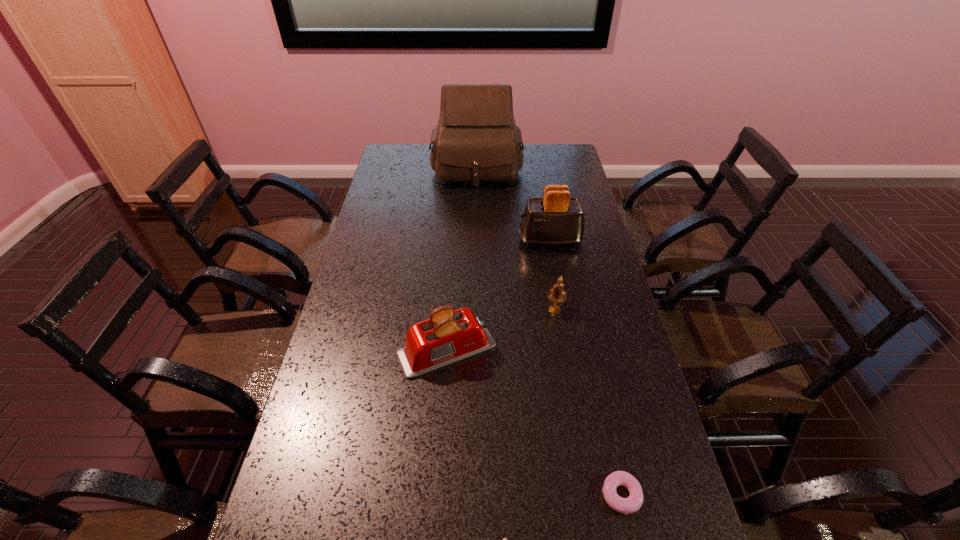
You are a GUI agent. You are given a task and a screenshot of the screen. Output one action in this format:
    pyautogui.click(x=<x>, y=<y>)
    Task: Click on the empty location between the candle holder and the satchel
    
    Given the screenshot: What is the action you would take?
    pyautogui.click(x=516, y=239)

You are a GUI agent. You are given a task and a screenshot of the screen. Output one action in this format:
    pyautogui.click(x=<x>, y=<y>)
    Task: Click on the object that is the fourth closest to the nearest object
    This screenshot has width=960, height=540.
    Given the screenshot: What is the action you would take?
    pyautogui.click(x=556, y=219)

Locate which object is the third closest to the fifth nearest object. Please provide its 2D coordinates. Your answer should be formatted as a tuple, i.e. [(x, y)], where the tuple contains the x and y coordinates of a point satisfying the conditions above.

[(449, 336)]

Where is `free space in the image that satisfies the following two spatial constraints: 1. on the side of the right toaster with the control lever; 2. on the front side of the fourth nearest object`? The width and height of the screenshot is (960, 540). free space in the image that satisfies the following two spatial constraints: 1. on the side of the right toaster with the control lever; 2. on the front side of the fourth nearest object is located at coordinates (563, 309).

Where is `free space in the image that satisfies the following two spatial constraints: 1. on the side of the second farthest object with the control lever; 2. on the front side of the nearer toaster`? free space in the image that satisfies the following two spatial constraints: 1. on the side of the second farthest object with the control lever; 2. on the front side of the nearer toaster is located at coordinates (570, 349).